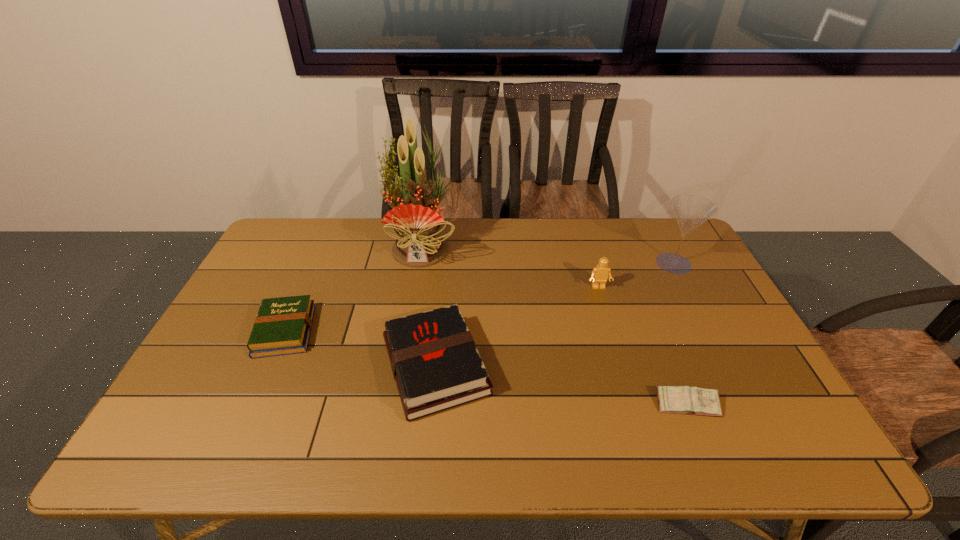
Locate an element on the screen. Image resolution: width=960 pixels, height=540 pixels. free space at the far edge of the desktop is located at coordinates (343, 237).

Where is `vacant region at the near edge of the desktop`? The height and width of the screenshot is (540, 960). vacant region at the near edge of the desktop is located at coordinates (537, 433).

You are a GUI agent. You are given a task and a screenshot of the screen. Output one action in this format:
    pyautogui.click(x=<x>, y=<y>)
    Task: Click on the vacant area at the left edge of the desktop
    This screenshot has width=960, height=540.
    Given the screenshot: What is the action you would take?
    pyautogui.click(x=286, y=296)

The image size is (960, 540). Find the location of `free space at the right edge of the desktop`. free space at the right edge of the desktop is located at coordinates (x=731, y=326).

Image resolution: width=960 pixels, height=540 pixels. In the image, there is a desktop. What are the coordinates of `vacant space at the far left corner` in the screenshot? It's located at (315, 241).

Where is `vacant area between the third shortest object and the flower arrangement`? This screenshot has width=960, height=540. vacant area between the third shortest object and the flower arrangement is located at coordinates (429, 306).

This screenshot has width=960, height=540. I want to click on blank region between the third tallest object and the diary, so click(x=643, y=346).

The image size is (960, 540). In order to click on free space between the fourth tallest object and the leftmost object in this screenshot , I will do `click(360, 348)`.

Where is `vacant space that is in between the book and the fourth tallest object`? vacant space that is in between the book and the fourth tallest object is located at coordinates (360, 348).

Identify the location of free space between the flower arrangement and the book. This screenshot has width=960, height=540. (354, 288).